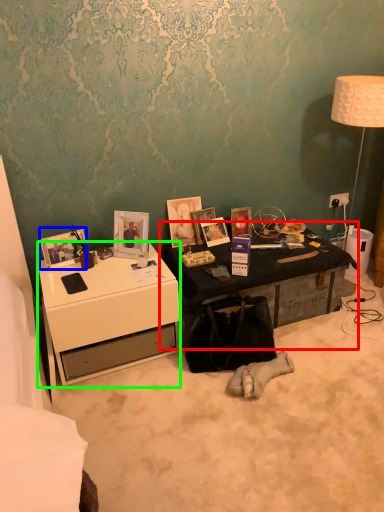
Question: Estimate the real-world distances between objects in this image. Which object is closer to table (highlighted by a red box), picture frame (highlighted by a blue box) or desk (highlighted by a green box)?

Choices:
 (A) picture frame
 (B) desk

Answer: (B)